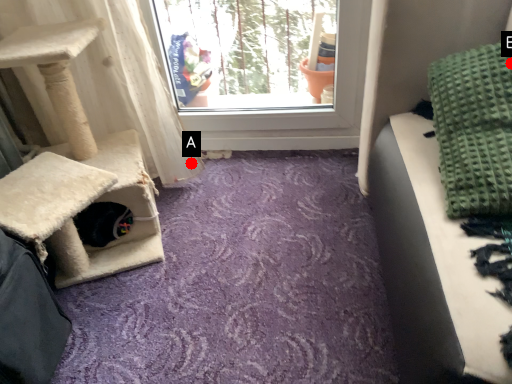
Question: Two points are circled on the image, labeled by A and B beside each circle. Which point is closer to the camera?

Choices:
 (A) A is closer
 (B) B is closer

Answer: (B)